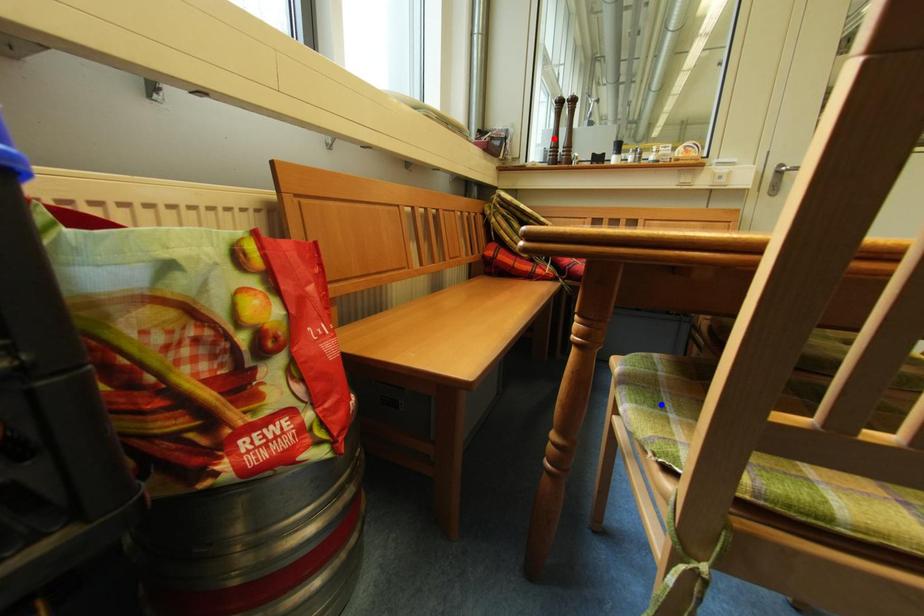
Question: In the image, two points are highlighted. Which point is nearer to the camera? Reply with the corresponding letter.

Choices:
 (A) blue point
 (B) red point

Answer: (A)